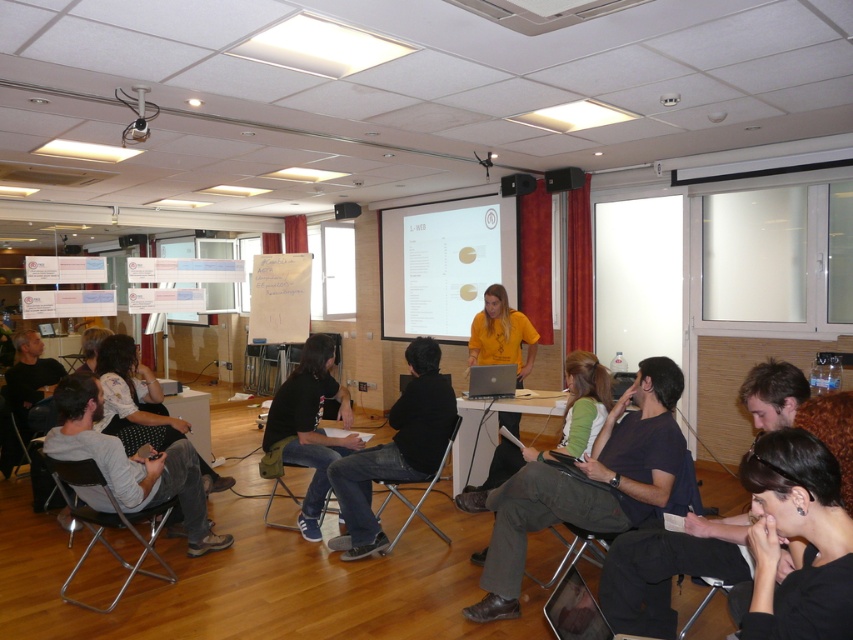
Question: Does black fabric chair at center have a lesser width compared to matte yellow shirt at center?

Choices:
 (A) yes
 (B) no

Answer: (B)

Question: Which of these objects is positioned farthest from the white matte projection screen at center?

Choices:
 (A) black plastic projector at upper center
 (B) metallic silver chair at lower left
 (C) black matte hair at lower right

Answer: (C)

Question: Is metallic gray chair at lower center wider than black fabric chair at center?

Choices:
 (A) yes
 (B) no

Answer: (B)

Question: Which point is farther to the camera?

Choices:
 (A) (343, 208)
 (B) (587, 547)

Answer: (A)

Question: Is dark brown fabric pants at lower center further to the viewer compared to metallic gray chair at lower center?

Choices:
 (A) no
 (B) yes

Answer: (B)

Question: Which of the following is the farthest from the observer?

Choices:
 (A) (677, 433)
 (B) (572, 179)
 (C) (579, 550)

Answer: (B)